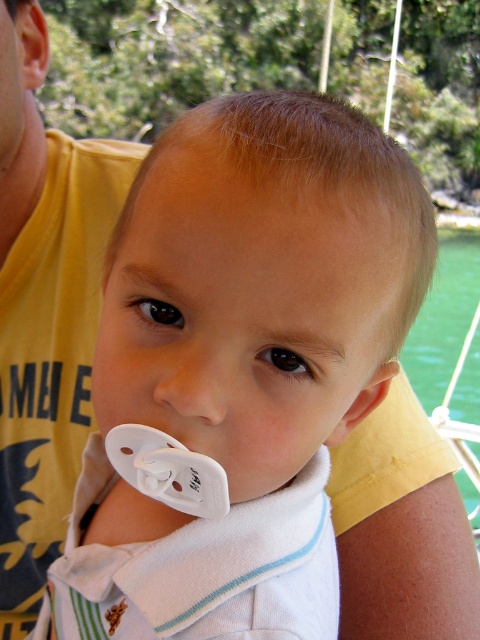
Can you confirm if white plastic pacifier at center is positioned below green water at lower right?

No, white plastic pacifier at center is not below green water at lower right.

Can you confirm if white plastic pacifier at center is shorter than green water at lower right?

Yes.

This screenshot has height=640, width=480. What do you see at coordinates (241, 320) in the screenshot?
I see `white plastic pacifier at center` at bounding box center [241, 320].

Where is `white plastic pacifier at center`? Image resolution: width=480 pixels, height=640 pixels. white plastic pacifier at center is located at coordinates (241, 320).